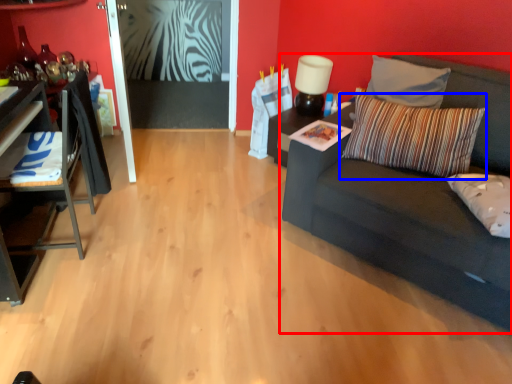
Question: Which of the following is the farthest to the observer, studio couch (highlighted by a red box) or pillow (highlighted by a blue box)?

Choices:
 (A) studio couch
 (B) pillow

Answer: (B)